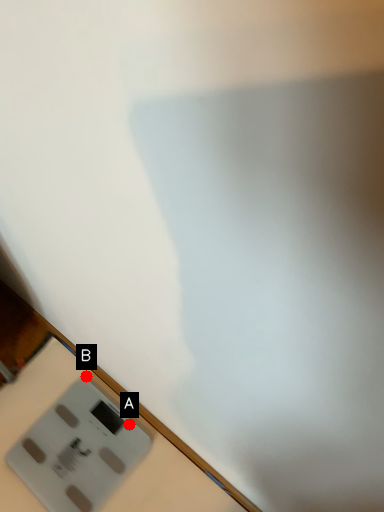
Question: Two points are circled on the image, labeled by A and B beside each circle. Which point is closer to the camera?

Choices:
 (A) A is closer
 (B) B is closer

Answer: (A)